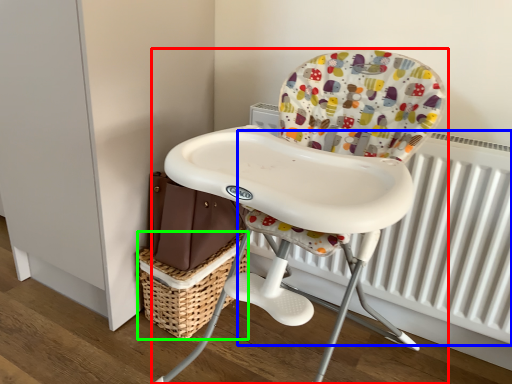
Question: Which is nearer to the chair (highlighted by a red box)? radiator (highlighted by a blue box) or basket (highlighted by a green box).

Choices:
 (A) radiator
 (B) basket

Answer: (A)